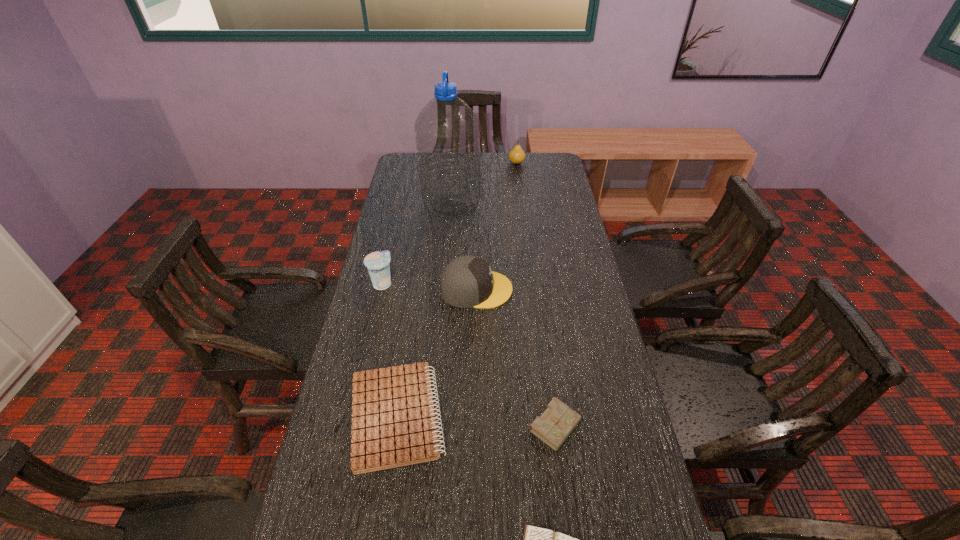
The width and height of the screenshot is (960, 540). Find the location of `unoccupied position between the taller diary and the cap`. unoccupied position between the taller diary and the cap is located at coordinates (516, 358).

Locate an element on the screen. This screenshot has height=540, width=960. empty space between the water jug and the yogurt is located at coordinates (417, 244).

Identify the location of object that is the sixth closest to the yogurt. (517, 155).

This screenshot has width=960, height=540. Find the location of `object that is the fourth closest one to the second farthest object`. object that is the fourth closest one to the second farthest object is located at coordinates (393, 420).

The image size is (960, 540). In order to click on free location that satisfies the following two spatial constraints: 1. on the front side of the farthest object; 2. on the front-facing side of the cap in this screenshot , I will do `click(532, 289)`.